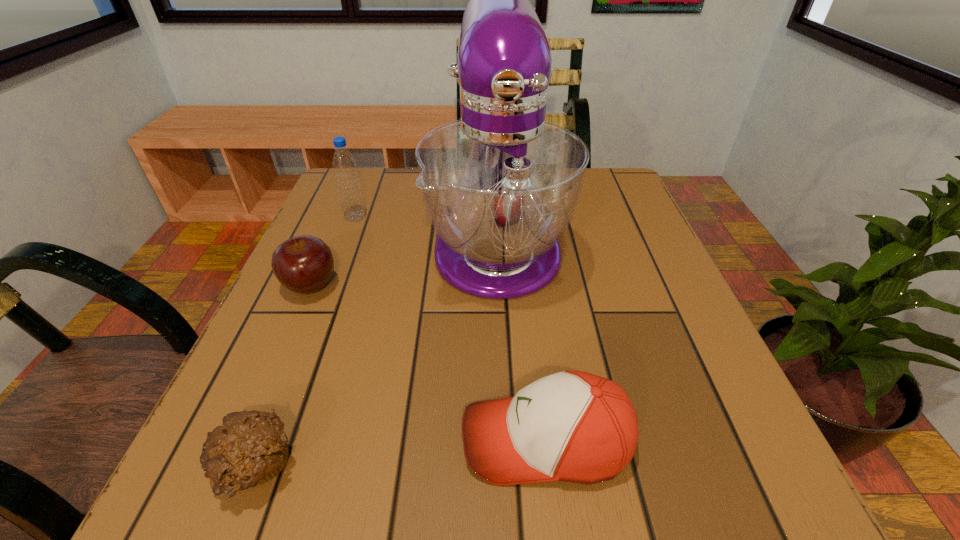
Locate an element on the screen. The width and height of the screenshot is (960, 540). object located in the near left corner section of the desktop is located at coordinates (250, 449).

Locate an element on the screen. This screenshot has width=960, height=540. free spot at the near edge of the desktop is located at coordinates tap(471, 511).

I want to click on free space at the right edge of the desktop, so click(609, 254).

Identify the location of free space at the far left corner. This screenshot has height=540, width=960. (368, 173).

In the image, there is a desktop. Where is `vacant space at the near left corner`? vacant space at the near left corner is located at coordinates (219, 515).

I want to click on vacant space at the far right corner, so click(x=582, y=208).

At what (x,y) coordinates should I click in order to perform the action: click on free space at the near right corner of the desktop. Please return your answer as a coordinate pair (x, y). Looking at the image, I should click on point(656,464).

Find the location of a particular element. free area in between the second tallest object and the baseball cap is located at coordinates (451, 329).

This screenshot has width=960, height=540. Identify the location of free spot between the shortest object and the fourth shortest object. (305, 342).

Identify the location of empty space between the mixer and the baseball cap. The width and height of the screenshot is (960, 540). (521, 339).